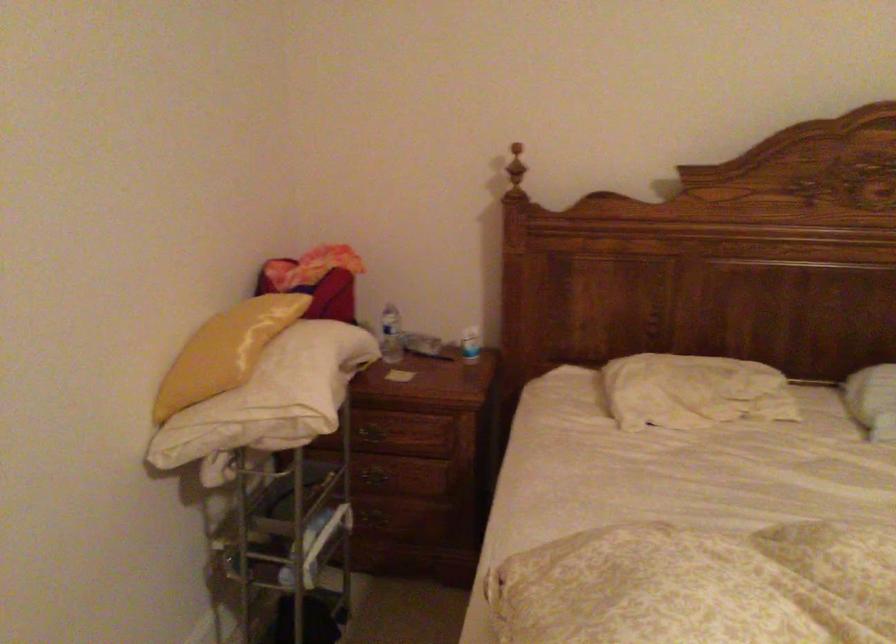
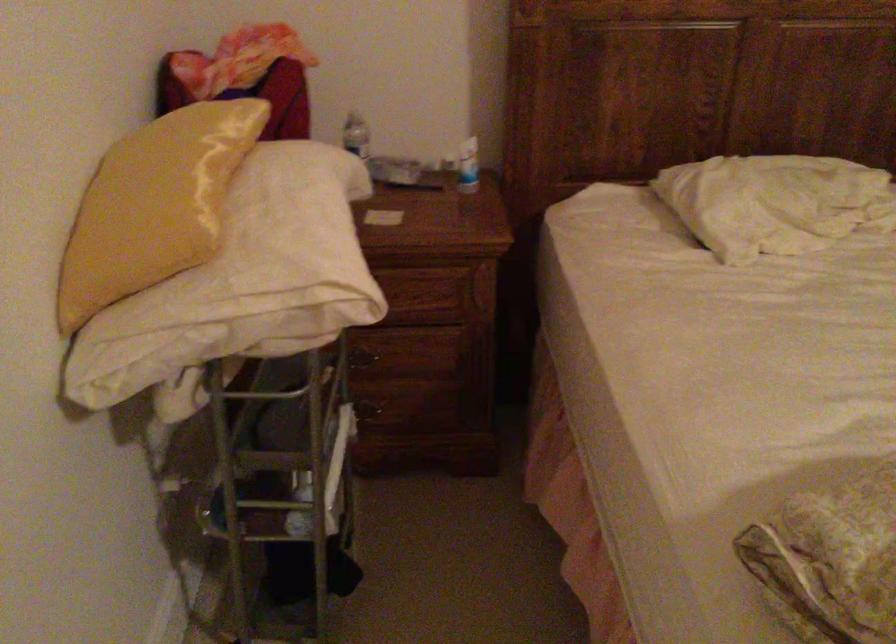
Which direction would the cameraman need to move to produce the second image?

The cameraman moved toward left, forward.